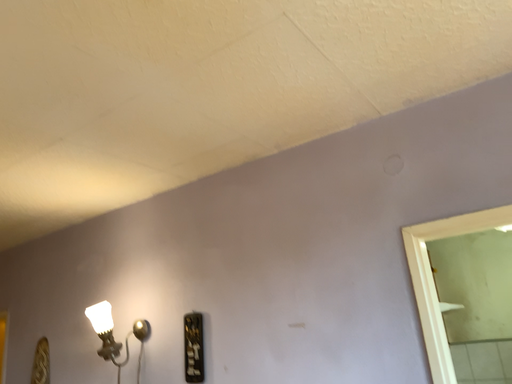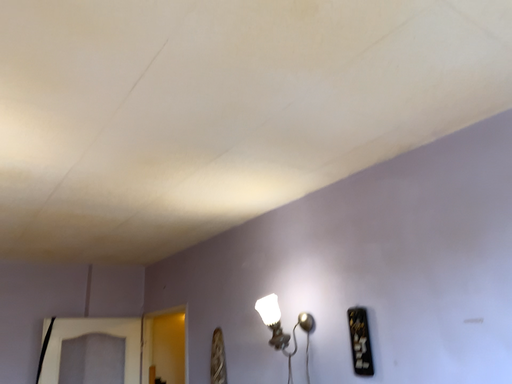
Question: How did the camera likely rotate when shooting the video?

Choices:
 (A) rotated right
 (B) rotated left

Answer: (B)